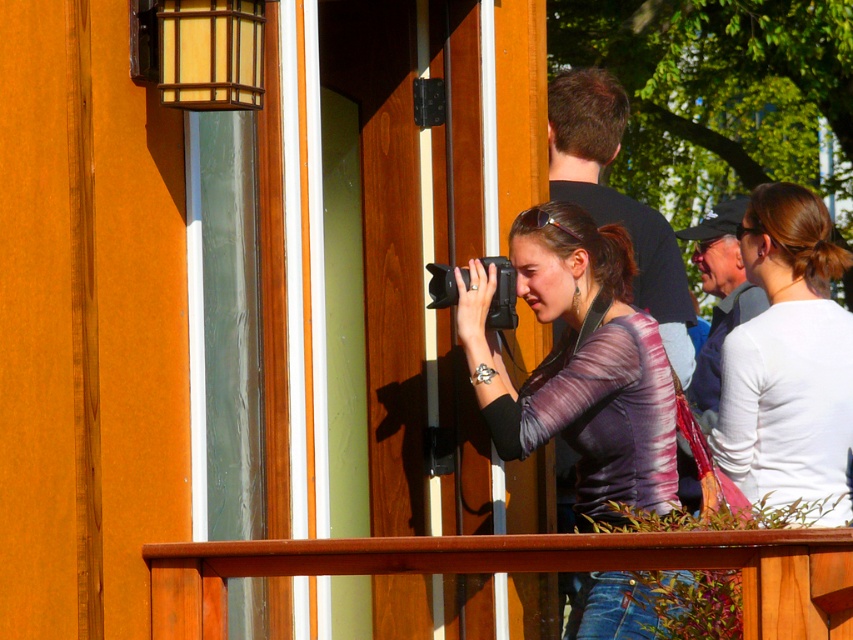
Question: Among these points, which one is nearest to the camera?

Choices:
 (A) (612, 284)
 (B) (512, 284)
 (C) (358, 560)
 (D) (770, 378)

Answer: (C)

Question: Which is farther from the matte purple shirt at center?

Choices:
 (A) wooden rail at center
 (B) white matte shirt at upper right
 (C) dark blue shirt at center

Answer: (A)

Question: Can you confirm if matte purple shirt at center is positioned above black plastic camera at center?

Choices:
 (A) no
 (B) yes

Answer: (A)

Question: Does wooden rail at center lie behind dark blue shirt at center?

Choices:
 (A) yes
 (B) no

Answer: (B)

Question: Is matte purple shirt at center wider than wooden rail at center?

Choices:
 (A) yes
 (B) no

Answer: (B)

Question: Which point is farther to the camera?

Choices:
 (A) (723, 280)
 (B) (643, 264)
 (C) (840, 342)

Answer: (A)